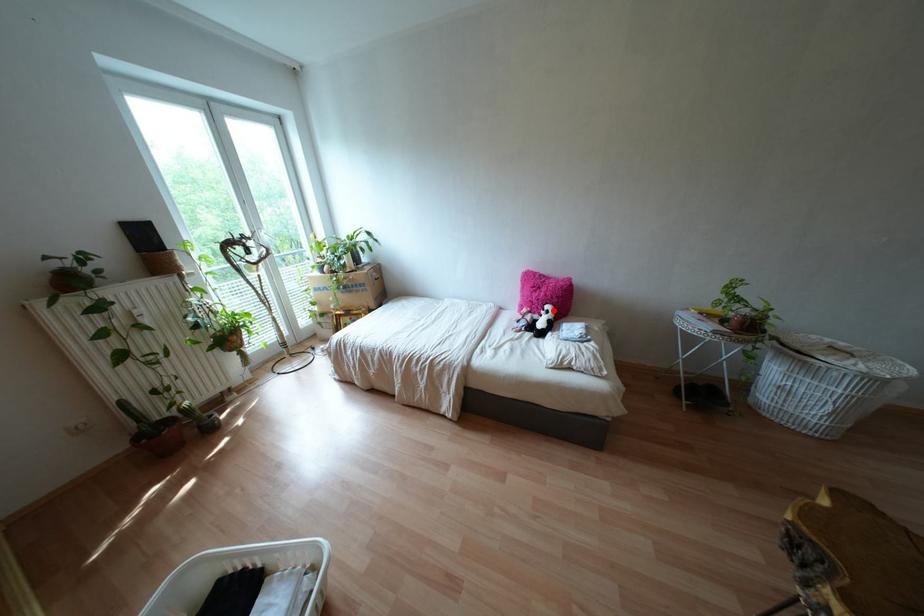
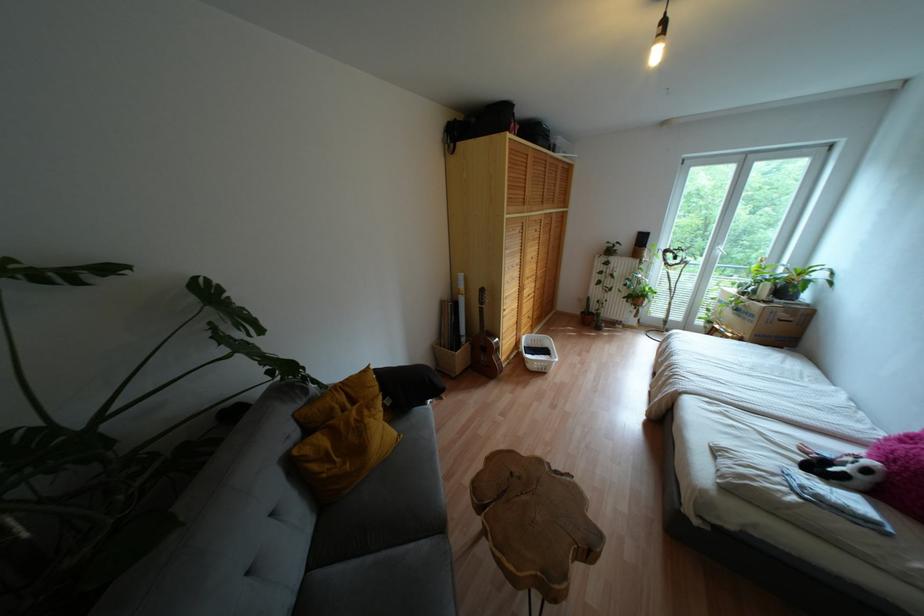
Question: I am providing you with two images of the same scene from different viewpoints. Given a red point in image1, look at the same physical point in image2. Is it:

Choices:
 (A) Closer to the viewpoint
 (B) Farther from the viewpoint

Answer: (B)